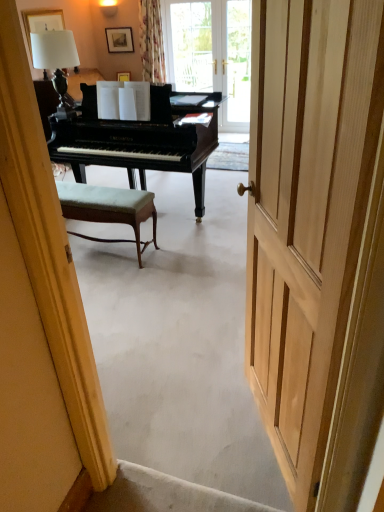
Question: Is white fabric lampshade at upper left inside floral fabric curtain at upper center?

Choices:
 (A) yes
 (B) no

Answer: (B)

Question: Is the depth of floral fabric curtain at upper center greater than that of white fabric lampshade at upper left?

Choices:
 (A) no
 (B) yes

Answer: (B)

Question: Considering the relative positions of floral fabric curtain at upper center and white fabric lampshade at upper left in the image provided, is floral fabric curtain at upper center in front of white fabric lampshade at upper left?

Choices:
 (A) yes
 (B) no

Answer: (B)

Question: Can you confirm if floral fabric curtain at upper center is smaller than white fabric lampshade at upper left?

Choices:
 (A) yes
 (B) no

Answer: (B)

Question: Is floral fabric curtain at upper center taller than white fabric lampshade at upper left?

Choices:
 (A) no
 (B) yes

Answer: (B)

Question: In the image, is matte gold picture frame at upper center, which is the first picture frame from bottom to top, on the left side or the right side of matte black picture frame at upper center, the first picture frame viewed from the top?

Choices:
 (A) right
 (B) left

Answer: (A)

Question: In terms of width, does matte gold picture frame at upper center, which is the first picture frame from bottom to top, look wider or thinner when compared to matte black picture frame at upper center, which ranks as the 2th picture frame in bottom-to-top order?

Choices:
 (A) wide
 (B) thin

Answer: (A)

Question: Is point (120, 74) closer or farther from the camera than point (125, 31)?

Choices:
 (A) farther
 (B) closer

Answer: (A)

Question: From the image's perspective, is matte gold picture frame at upper center, marked as the second picture frame in a top-to-bottom arrangement, above or below matte black picture frame at upper center, which ranks as the 2th picture frame in bottom-to-top order?

Choices:
 (A) above
 (B) below

Answer: (B)

Question: Would you say floral fabric curtain at upper center is inside or outside light wood door at center?

Choices:
 (A) inside
 (B) outside

Answer: (B)

Question: In terms of size, does floral fabric curtain at upper center appear bigger or smaller than light wood door at center?

Choices:
 (A) big
 (B) small

Answer: (A)

Question: From their relative heights in the image, would you say floral fabric curtain at upper center is taller or shorter than light wood door at center?

Choices:
 (A) short
 (B) tall

Answer: (A)

Question: From the image's perspective, relative to light wood door at center, is floral fabric curtain at upper center above or below?

Choices:
 (A) below
 (B) above

Answer: (B)

Question: Which is correct: matte black picture frame at upper center, the first picture frame viewed from the top, is inside matte gold picture frame at upper center, marked as the second picture frame in a top-to-bottom arrangement, or outside of it?

Choices:
 (A) inside
 (B) outside

Answer: (B)

Question: Would you say matte black picture frame at upper center, which ranks as the 2th picture frame in bottom-to-top order, is to the left or to the right of matte gold picture frame at upper center, marked as the second picture frame in a top-to-bottom arrangement, in the picture?

Choices:
 (A) left
 (B) right

Answer: (A)